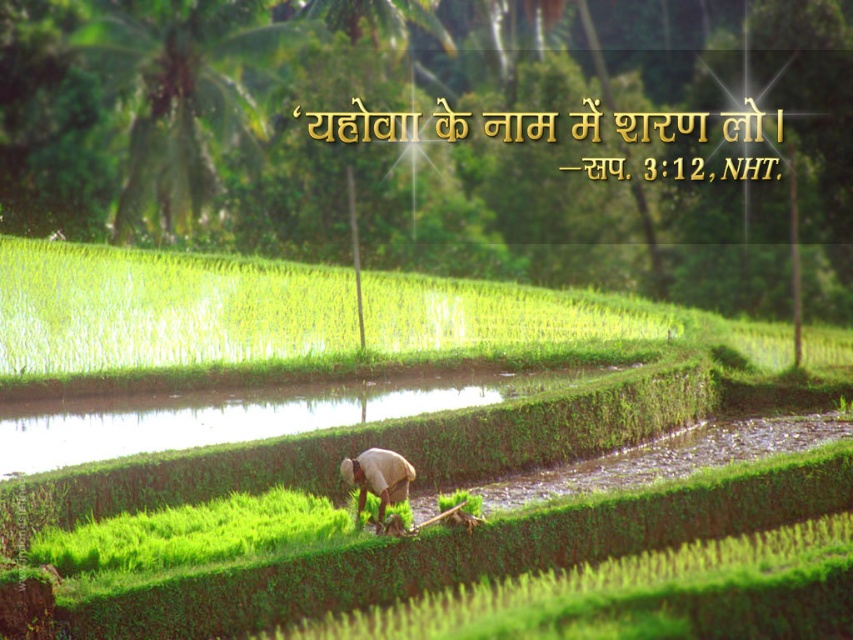
Is point (90, 483) less distant than point (360, 497)?

No, it is behind (360, 497).

You are a GUI agent. You are given a task and a screenshot of the screen. Output one action in this format:
    pyautogui.click(x=<x>, y=<y>)
    Task: Click on the green grass at center
    This screenshot has height=640, width=853.
    Given the screenshot: What is the action you would take?
    pyautogui.click(x=422, y=413)

In order to click on green grass at center in this screenshot , I will do `click(422, 413)`.